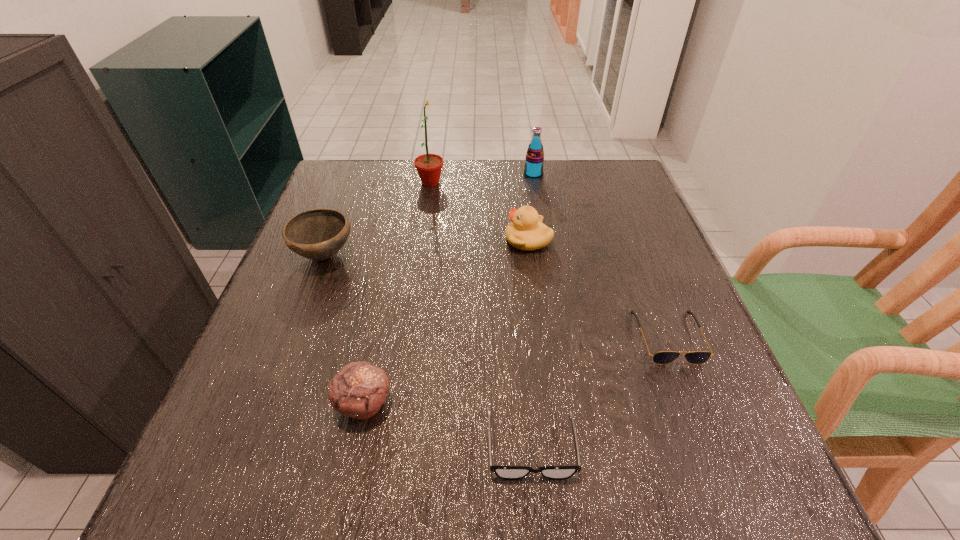
Image resolution: width=960 pixels, height=540 pixels. In order to click on vacant area that lies between the sixth shortest object and the sunglasses in this screenshot , I will do `click(601, 255)`.

Locate an element on the screen. This screenshot has height=540, width=960. free space between the tallest object and the duckling is located at coordinates (479, 212).

The image size is (960, 540). I want to click on vacant space in between the bowl and the muffin, so pos(345,329).

Locate an element on the screen. This screenshot has width=960, height=540. free space between the sunflower and the second tallest object is located at coordinates (482, 178).

You are a GUI agent. You are given a task and a screenshot of the screen. Output one action in this format:
    pyautogui.click(x=<x>, y=<y>)
    Task: Click on the empty location between the spectacles and the muffin
    
    Given the screenshot: What is the action you would take?
    pyautogui.click(x=447, y=425)

This screenshot has width=960, height=540. Identify the location of vacant region between the spectacles and the leftmost object. (428, 350).

Identify which object is the closest to the second tallest object. Please provide its 2D coordinates. Your answer should be formatted as a tuple, i.e. [(x, y)], where the tuple contains the x and y coordinates of a point satisfying the conditions above.

[(526, 232)]

This screenshot has height=540, width=960. Identify the location of object that is the second closest to the rightmost object. (526, 232).

Locate an element on the screen. This screenshot has height=540, width=960. vacant position in the image that satisfies the following two spatial constraints: 1. on the beak of the duckling; 2. on the front side of the leftmost object is located at coordinates (530, 255).

Identify the location of vacant area in the image that satisfies the following two spatial constraints: 1. on the beak of the duckling; 2. on the front-facing side of the spectacles. (553, 446).